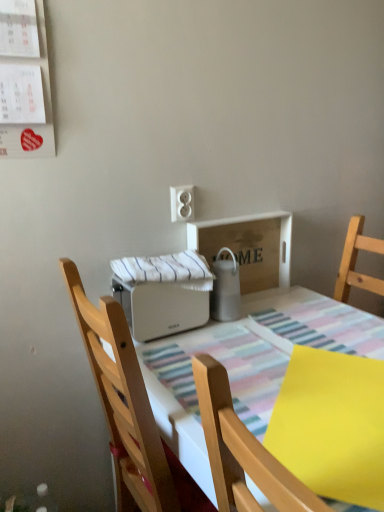
Locate an element on the screen. empty space that is ontop of wooden tray at center (from a real-world perspective) is located at coordinates (240, 215).